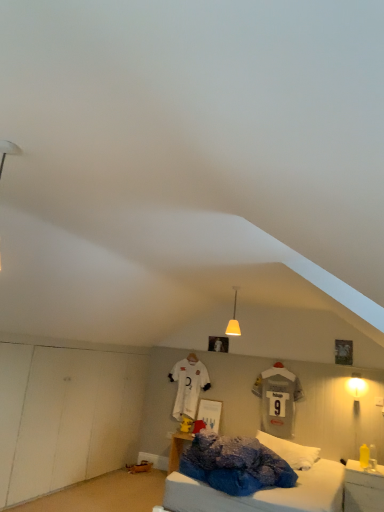
What do you see at coordinates (290, 451) in the screenshot?
I see `white fluffy pillow at center` at bounding box center [290, 451].

In order to click on yellow plastic bottle at lower right in this screenshot , I will do `click(363, 488)`.

This screenshot has width=384, height=512. I want to click on matte yellow glass pendant light at center, arranged as the second light fixture when viewed from the back, so click(x=234, y=319).

Is the depth of white fluffy pillow at center greater than that of yellow plastic bottle at lower right?

Yes, white fluffy pillow at center is further from the viewer.

Looking at this image, considering the relative positions of white fluffy pillow at center and yellow plastic bottle at lower right in the image provided, is white fluffy pillow at center to the left or to the right of yellow plastic bottle at lower right?

In the image, white fluffy pillow at center appears on the left side of yellow plastic bottle at lower right.

The height and width of the screenshot is (512, 384). In the image, there is a yellow plastic bottle at lower right. In order to click on pillow above it (from the image's perspective) in this screenshot , I will do `click(290, 451)`.

In terms of height, does white fluffy pillow at center look taller or shorter compared to yellow plastic bottle at lower right?

white fluffy pillow at center is shorter than yellow plastic bottle at lower right.

Is point (234, 306) closer to camera compared to point (345, 482)?

No, (234, 306) is behind (345, 482).

How different are the orientations of matte yellow glass pendant light at center, placed as the 1th light fixture when sorted from top to bottom, and yellow plastic bottle at lower right in degrees?

A: The angular difference between matte yellow glass pendant light at center, placed as the 1th light fixture when sorted from top to bottom, and yellow plastic bottle at lower right is 3.15 degrees.

From the image's perspective, is matte yellow glass pendant light at center, arranged as the second light fixture when viewed from the back, over yellow plastic bottle at lower right?

Yes.

From the image's perspective, which object appears higher, yellow plastic bottle at lower right or matte yellow glass pendant light at center, marked as the 1th light fixture in a left-to-right arrangement?

matte yellow glass pendant light at center, marked as the 1th light fixture in a left-to-right arrangement, is shown above in the image.

Considering the relative positions of yellow plastic bottle at lower right and matte yellow glass pendant light at center, placed as the 1th light fixture when sorted from top to bottom, in the image provided, is yellow plastic bottle at lower right to the left or to the right of matte yellow glass pendant light at center, placed as the 1th light fixture when sorted from top to bottom,?

Clearly, yellow plastic bottle at lower right is on the right of matte yellow glass pendant light at center, placed as the 1th light fixture when sorted from top to bottom, in the image.

Which is in front, yellow plastic bottle at lower right or matte yellow glass pendant light at center, marked as the 1th light fixture in a left-to-right arrangement?

yellow plastic bottle at lower right is in front.

From a real-world perspective, is yellow plastic bottle at lower right physically above matte yellow glass pendant light at center, which is counted as the 2th light fixture, starting from the right?

Incorrect, from a real-world perspective, yellow plastic bottle at lower right is lower than matte yellow glass pendant light at center, which is counted as the 2th light fixture, starting from the right.

Can you tell me how much matte yellow glass pendant light at center, marked as the 1th light fixture in a left-to-right arrangement, and matte yellow lampshade at right, the 1th light fixture when ordered from right to left, differ in facing direction?

1.39 degrees.

Relative to matte yellow lampshade at right, which is counted as the second light fixture, starting from the front, is matte yellow glass pendant light at center, marked as the 1th light fixture in a left-to-right arrangement, in front or behind?

Visually, matte yellow glass pendant light at center, marked as the 1th light fixture in a left-to-right arrangement, is located in front of matte yellow lampshade at right, which is counted as the second light fixture, starting from the front.

Which is more to the right, matte yellow glass pendant light at center, the 2th light fixture ordered from the bottom, or matte yellow lampshade at right, acting as the 1th light fixture starting from the bottom?

From the viewer's perspective, matte yellow lampshade at right, acting as the 1th light fixture starting from the bottom, appears more on the right side.

Which is farther, (237, 291) or (355, 389)?

The point (355, 389) is behind.

From a real-world perspective, which object rests below the other?

In real-world perspective, yellow plastic bottle at lower right is lower.

From the image's perspective, is yellow plastic bottle at lower right below white fluffy pillow at center?

Yes, from the image's perspective, yellow plastic bottle at lower right is below white fluffy pillow at center.

At what (x,y) coordinates should I click in order to perform the action: click on pillow above the yellow plastic bottle at lower right (from a real-world perspective). Please return your answer as a coordinate pair (x, y). Looking at the image, I should click on (290, 451).

Is the position of white fluffy pillow at center more distant than that of matte yellow glass pendant light at center, arranged as the second light fixture when viewed from the back?

Yes.

Is white fluffy pillow at center bigger or smaller than matte yellow glass pendant light at center, the 2th light fixture ordered from the bottom?

Clearly, white fluffy pillow at center is larger in size than matte yellow glass pendant light at center, the 2th light fixture ordered from the bottom.

Is white fluffy pillow at center located outside matte yellow glass pendant light at center, placed as the 1th light fixture when sorted from top to bottom?

white fluffy pillow at center is positioned outside matte yellow glass pendant light at center, placed as the 1th light fixture when sorted from top to bottom.

Would you say matte yellow lampshade at right, acting as the 1th light fixture starting from the bottom, is to the left or to the right of yellow plastic bottle at lower right in the picture?

matte yellow lampshade at right, acting as the 1th light fixture starting from the bottom, is to the right of yellow plastic bottle at lower right.

How different are the orientations of matte yellow lampshade at right, the 1th light fixture when ordered from right to left, and yellow plastic bottle at lower right in degrees?

The angle between the facing direction of matte yellow lampshade at right, the 1th light fixture when ordered from right to left, and the facing direction of yellow plastic bottle at lower right is 1.75 degrees.

From a real-world perspective, which is physically above, matte yellow lampshade at right, the 1th light fixture when ordered from right to left, or yellow plastic bottle at lower right?

matte yellow lampshade at right, the 1th light fixture when ordered from right to left.

In the scene shown: In terms of height, does matte yellow lampshade at right, the 1th light fixture when ordered from right to left, look taller or shorter compared to yellow plastic bottle at lower right?

In the image, matte yellow lampshade at right, the 1th light fixture when ordered from right to left, appears to be shorter than yellow plastic bottle at lower right.

Where is `pillow above the yellow plastic bottle at lower right (from a real-world perspective)`? This screenshot has width=384, height=512. pillow above the yellow plastic bottle at lower right (from a real-world perspective) is located at coordinates (290, 451).

Where is `the 1st light fixture behind the yellow plastic bottle at lower right, counting from the anchor's position`? The width and height of the screenshot is (384, 512). the 1st light fixture behind the yellow plastic bottle at lower right, counting from the anchor's position is located at coordinates (234, 319).

Based on their spatial positions, is yellow plastic bottle at lower right or white fluffy pillow at center further from matte yellow glass pendant light at center, which is counted as the 2th light fixture, starting from the right?

The object further to matte yellow glass pendant light at center, which is counted as the 2th light fixture, starting from the right, is yellow plastic bottle at lower right.

When comparing their distances from matte yellow glass pendant light at center, arranged as the second light fixture when viewed from the back, does matte yellow lampshade at right, acting as the 1th light fixture starting from the bottom, or yellow plastic bottle at lower right seem further?

yellow plastic bottle at lower right lies further to matte yellow glass pendant light at center, arranged as the second light fixture when viewed from the back, than the other object.

Considering their positions, is yellow plastic bottle at lower right positioned further to white fluffy pillow at center than matte yellow glass pendant light at center, placed as the 1th light fixture when sorted from top to bottom?

matte yellow glass pendant light at center, placed as the 1th light fixture when sorted from top to bottom, lies further to white fluffy pillow at center than the other object.

Based on their spatial positions, is yellow plastic bottle at lower right or matte yellow glass pendant light at center, arranged as the 1th light fixture when viewed from the front, further from matte yellow lampshade at right, which is counted as the second light fixture, starting from the front?

matte yellow glass pendant light at center, arranged as the 1th light fixture when viewed from the front, is further to matte yellow lampshade at right, which is counted as the second light fixture, starting from the front.

Based on their spatial positions, is matte yellow lampshade at right, acting as the 1th light fixture starting from the bottom, or matte yellow glass pendant light at center, which is counted as the 2th light fixture, starting from the right, further from yellow plastic bottle at lower right?

matte yellow glass pendant light at center, which is counted as the 2th light fixture, starting from the right, is positioned further to the anchor yellow plastic bottle at lower right.

From the image, which object appears to be nearer to white fluffy pillow at center, matte yellow lampshade at right, the first light fixture positioned from the back, or yellow plastic bottle at lower right?

Based on the image, yellow plastic bottle at lower right appears to be nearer to white fluffy pillow at center.

From the image, which object appears to be nearer to matte yellow glass pendant light at center, the 2th light fixture ordered from the bottom, white fluffy pillow at center or matte yellow lampshade at right, the first light fixture positioned from the back?

white fluffy pillow at center is positioned closer to the anchor matte yellow glass pendant light at center, the 2th light fixture ordered from the bottom.

Looking at this image, looking at the image, which one is located further to yellow plastic bottle at lower right, matte yellow glass pendant light at center, the 2th light fixture ordered from the bottom, or matte yellow lampshade at right, the first light fixture positioned from the back?

Among the two, matte yellow glass pendant light at center, the 2th light fixture ordered from the bottom, is located further to yellow plastic bottle at lower right.

Where is `light fixture between matte yellow glass pendant light at center, arranged as the second light fixture when viewed from the back, and white fluffy pillow at center, in the vertical direction`? light fixture between matte yellow glass pendant light at center, arranged as the second light fixture when viewed from the back, and white fluffy pillow at center, in the vertical direction is located at coordinates (356, 390).

I want to click on pillow between matte yellow glass pendant light at center, placed as the 1th light fixture when sorted from top to bottom, and yellow plastic bottle at lower right vertically, so click(290, 451).

In order to click on light fixture between matte yellow glass pendant light at center, which is counted as the 2th light fixture, starting from the right, and yellow plastic bottle at lower right, in the vertical direction in this screenshot , I will do [x=356, y=390].

Find the location of a particular element. nightstand between white fluffy pillow at center and matte yellow lampshade at right, acting as the 1th light fixture starting from the bottom, in the horizontal direction is located at coordinates (363, 488).